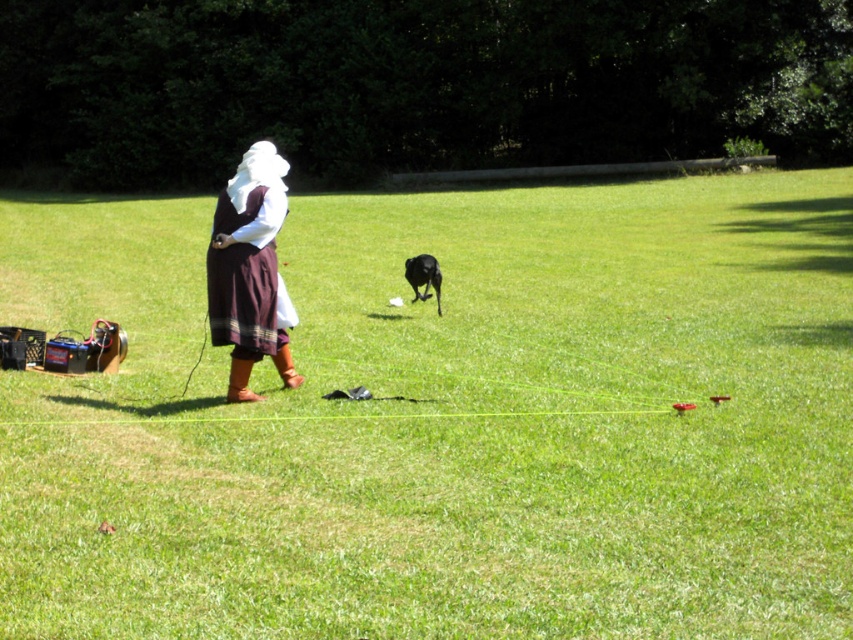
Is green grassy field at center below brown woven skirt at center?

No.

Locate an element on the screen. This screenshot has height=640, width=853. green grassy field at center is located at coordinates (444, 419).

Can you confirm if brown woven skirt at center is positioned above black glossy dog at center?

Actually, brown woven skirt at center is below black glossy dog at center.

Between point (241, 237) and point (421, 282), which one is positioned in front?

Positioned in front is point (241, 237).

Is point (210, 244) positioned in front of point (425, 280)?

That is True.

Locate an element on the screen. The image size is (853, 640). brown woven skirt at center is located at coordinates (250, 269).

Is green grassy field at center below black glossy dog at center?

Yes, green grassy field at center is below black glossy dog at center.

Which of these two, green grassy field at center or black glossy dog at center, stands shorter?

black glossy dog at center is shorter.

Does point (788, 412) come closer to viewer compared to point (424, 276)?

Yes, point (788, 412) is in front of point (424, 276).

Image resolution: width=853 pixels, height=640 pixels. In order to click on green grassy field at center in this screenshot , I will do `click(444, 419)`.